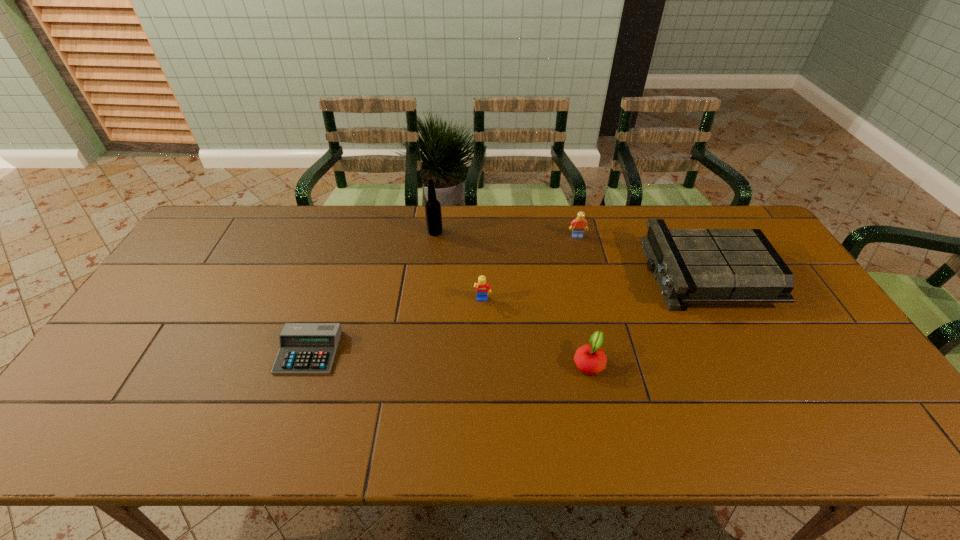
Where is `free space that satisfies the following two spatial constraints: 1. on the front panel of the radio receiver; 2. on the front side of the second shortest object`? The height and width of the screenshot is (540, 960). free space that satisfies the following two spatial constraints: 1. on the front panel of the radio receiver; 2. on the front side of the second shortest object is located at coordinates (752, 362).